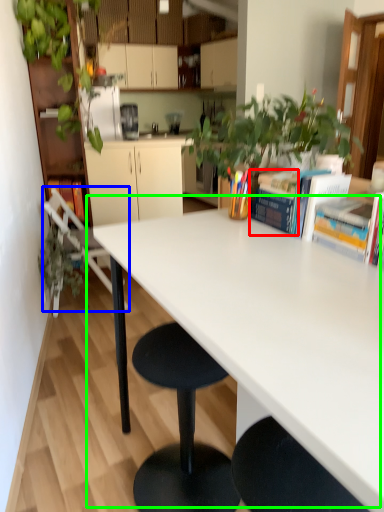
Question: Estimate the real-world distances between objects in this image. Which object is closer to book (highlighted by a red box), chair (highlighted by a blue box) or table (highlighted by a green box)?

Choices:
 (A) chair
 (B) table

Answer: (B)